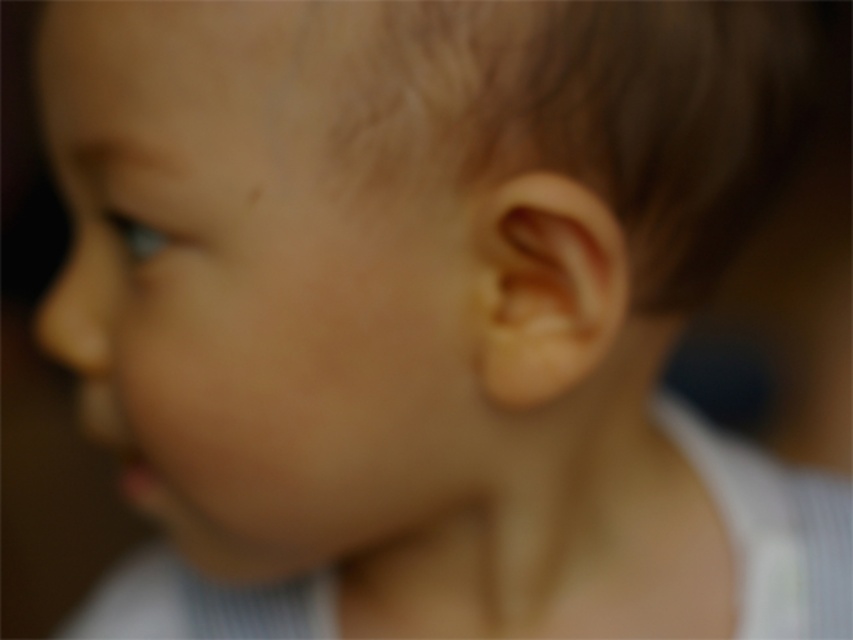
Looking at the child in the image, which object is positioned to the left of the other between the smooth skin face at center and the brown fuzzy hair at upper right?

The smooth skin face at center is positioned to the left of the brown fuzzy hair at upper right.

You are a photographer adjusting the focus on a camera. The subject is a child whose face is shown in the image. You need to ensure that both the smooth skin face at center and the brown fuzzy hair at upper right are in focus. Given the current blurred background, can you confirm if both areas are sharp and clear?

The smooth skin face at center is below the brown fuzzy hair at upper right, so they are at different heights. Since the background is blurred with a shallow depth of field, only the areas at the same distance from the camera will be in focus. Therefore, both the smooth skin face at center and the brown fuzzy hair at upper right may not be in focus simultaneously due to their different positions.